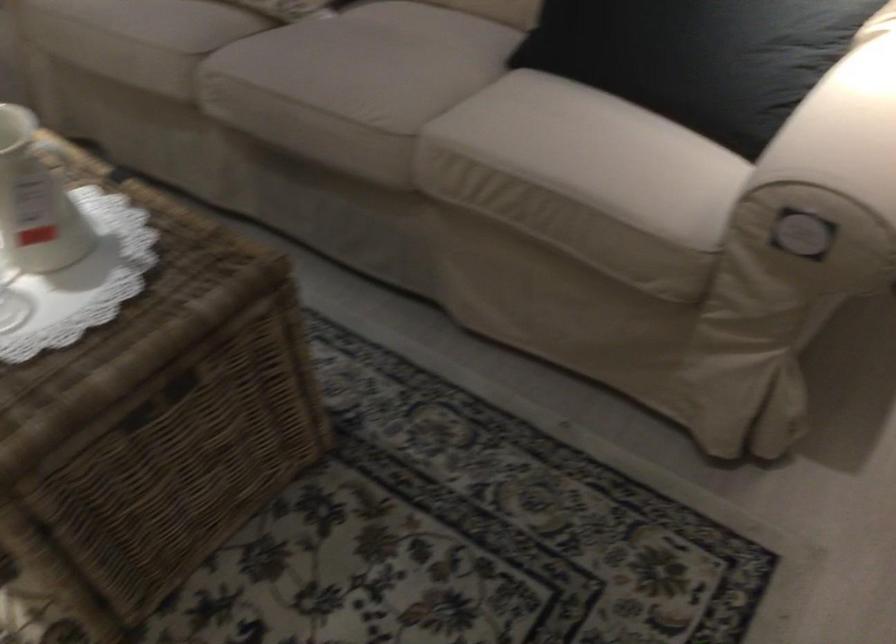
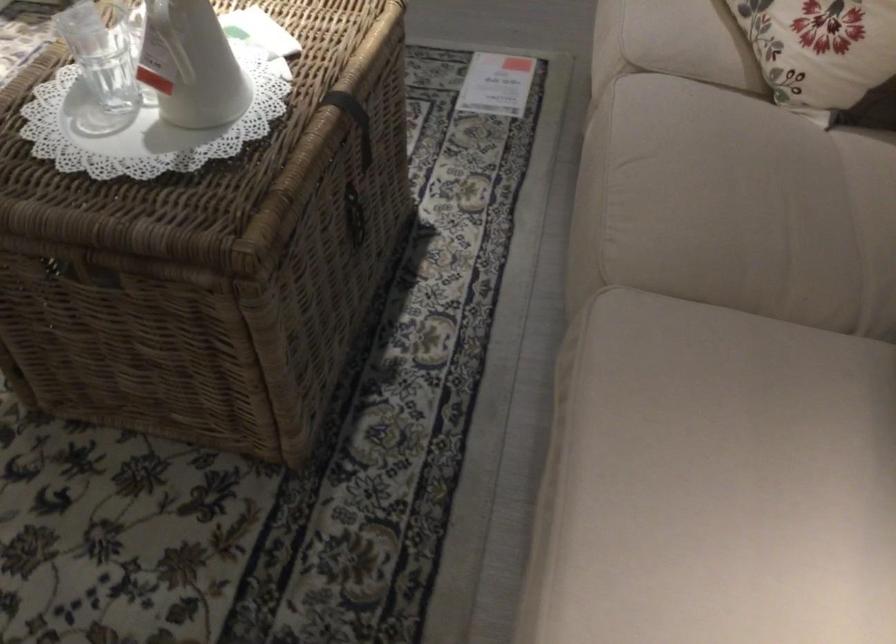
How did the camera likely rotate?

The rotation direction of the camera is left-down.